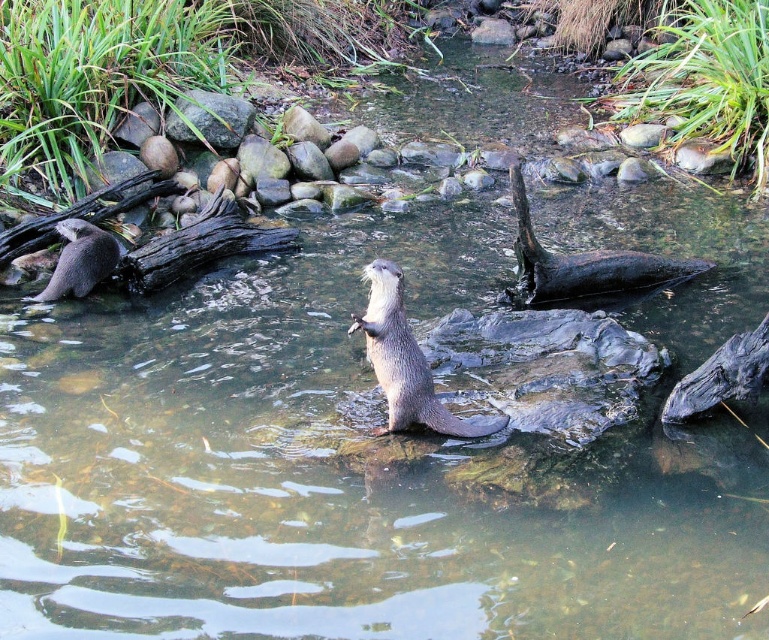
Question: Can you confirm if charcoal smooth log at right is smaller than gray smooth rock at upper center?

Choices:
 (A) yes
 (B) no

Answer: (A)

Question: Where is black smooth log at center located in relation to charcoal smooth log at right in the image?

Choices:
 (A) right
 (B) left

Answer: (B)

Question: Which object is the farthest from the gray fur otter at center?

Choices:
 (A) black smooth log at center
 (B) gray smooth rock at upper center
 (C) gray fur otter at left

Answer: (B)

Question: Which of the following is the closest to the observer?

Choices:
 (A) charcoal smooth log at right
 (B) black smooth log at center
 (C) gray fur otter at center

Answer: (C)

Question: Does gray fur otter at left have a smaller size compared to gray smooth rock at upper center?

Choices:
 (A) yes
 (B) no

Answer: (A)

Question: Which point is farther to the camera?

Choices:
 (A) (728, 356)
 (B) (62, 230)

Answer: (B)